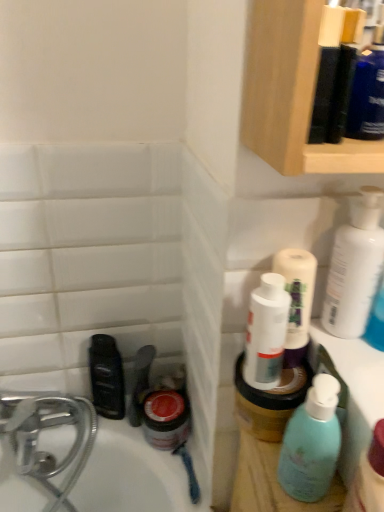
Question: Is black plastic mouthwash at lower left touching white glossy lotion at upper right?

Choices:
 (A) yes
 (B) no

Answer: (B)

Question: Is white glossy lotion at upper right at the back of black plastic mouthwash at lower left?

Choices:
 (A) yes
 (B) no

Answer: (B)

Question: Is black plastic mouthwash at lower left bigger than white glossy lotion at upper right?

Choices:
 (A) no
 (B) yes

Answer: (A)

Question: Does black plastic mouthwash at lower left turn towards white glossy lotion at upper right?

Choices:
 (A) no
 (B) yes

Answer: (A)

Question: Is black plastic mouthwash at lower left outside of white glossy lotion at upper right?

Choices:
 (A) yes
 (B) no

Answer: (A)

Question: From the image's perspective, is black plastic mouthwash at lower left on top of white glossy lotion at upper right?

Choices:
 (A) yes
 (B) no

Answer: (B)

Question: Considering the relative sizes of white glossy lotion at upper right and black plastic mouthwash at lower left in the image provided, is white glossy lotion at upper right bigger than black plastic mouthwash at lower left?

Choices:
 (A) yes
 (B) no

Answer: (A)

Question: Is the depth of white glossy lotion at upper right less than that of black plastic mouthwash at lower left?

Choices:
 (A) yes
 (B) no

Answer: (A)

Question: Is white glossy lotion at upper right taller than black plastic mouthwash at lower left?

Choices:
 (A) no
 (B) yes

Answer: (A)

Question: Is white glossy lotion at upper right aimed at black plastic mouthwash at lower left?

Choices:
 (A) yes
 (B) no

Answer: (B)

Question: Is white glossy lotion at upper right located outside black plastic mouthwash at lower left?

Choices:
 (A) no
 (B) yes

Answer: (B)

Question: Does white glossy lotion at upper right come behind black plastic mouthwash at lower left?

Choices:
 (A) no
 (B) yes

Answer: (A)

Question: From a real-world perspective, is teal matte bottle at right physically above black plastic mouthwash at lower left?

Choices:
 (A) no
 (B) yes

Answer: (B)